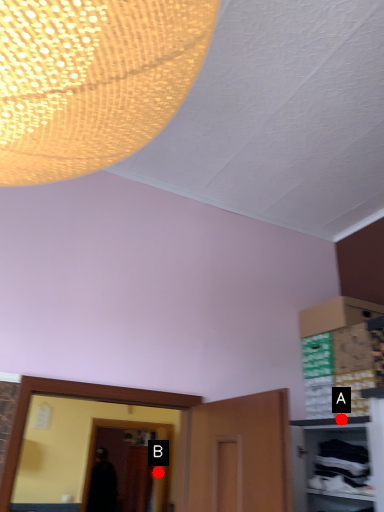
Question: Two points are circled on the image, labeled by A and B beside each circle. Among these points, which one is farthest from the camera?

Choices:
 (A) A is further
 (B) B is further

Answer: (B)